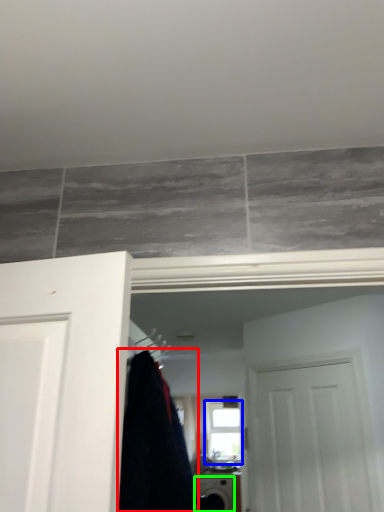
Question: Considering the real-world distances, which object is farthest from clothing (highlighted by a red box)? window (highlighted by a blue box) or appliance (highlighted by a green box)?

Choices:
 (A) window
 (B) appliance

Answer: (A)